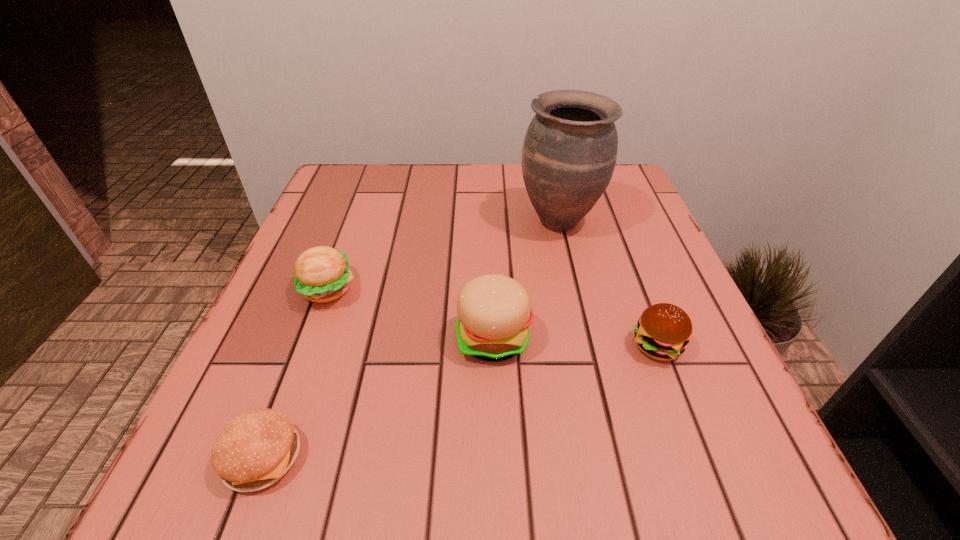
Locate an element on the screen. Image resolution: width=960 pixels, height=540 pixels. the tallest object is located at coordinates (569, 153).

Locate an element on the screen. The image size is (960, 540). the farthest object is located at coordinates (569, 153).

Image resolution: width=960 pixels, height=540 pixels. I want to click on the third object from left to right, so click(494, 311).

Where is `the tallest hamburger`? the tallest hamburger is located at coordinates (494, 311).

This screenshot has height=540, width=960. What are the coordinates of `the rightmost hamburger` in the screenshot? It's located at 663,331.

Where is `the nearest object`? This screenshot has height=540, width=960. the nearest object is located at coordinates (254, 450).

Where is `the nearest hamburger`? This screenshot has height=540, width=960. the nearest hamburger is located at coordinates (254, 450).

At what (x,y) coordinates should I click in order to perform the action: click on vacant space located on the front of the farthest object. Please return your answer as a coordinate pair (x, y). The width and height of the screenshot is (960, 540). Looking at the image, I should click on (583, 320).

Identify the location of free space located 0.120m on the front of the tallest hamburger. This screenshot has width=960, height=540. (496, 438).

The image size is (960, 540). Identify the location of vacant point located 0.090m on the left of the rightmost hamburger. (576, 346).